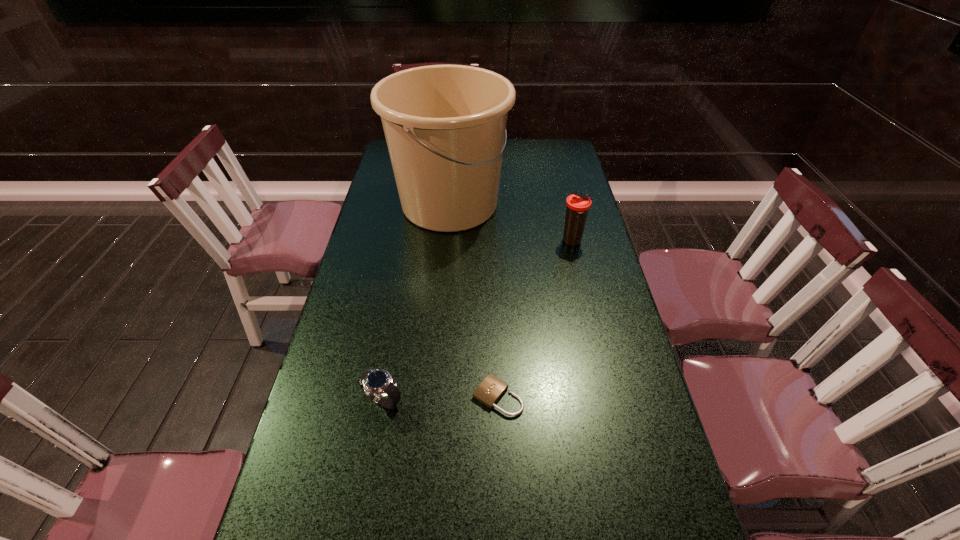
I want to click on vacant point located between the third shortest object and the tallest object, so click(511, 223).

Locate an element on the screen. empty space between the bucket and the watch is located at coordinates click(417, 302).

The height and width of the screenshot is (540, 960). Find the location of `free space between the watch and the second tallest object`. free space between the watch and the second tallest object is located at coordinates (478, 321).

Find the location of a particular element. The image size is (960, 540). empty space that is in between the bucket and the watch is located at coordinates (417, 302).

At what (x,y) coordinates should I click in order to perform the action: click on vacant point located between the bucket and the shortest object. Please return your answer as a coordinate pair (x, y). Looking at the image, I should click on (474, 300).

The image size is (960, 540). I want to click on object that is the second closest to the second tallest object, so click(x=490, y=390).

The width and height of the screenshot is (960, 540). I want to click on object that is the second closest to the tallest object, so click(x=490, y=390).

What are the coordinates of `vacant region that satisfies the following two spatial constraints: 1. on the back side of the bucket; 2. on the right side of the watch` in the screenshot? It's located at (418, 204).

You are a GUI agent. You are given a task and a screenshot of the screen. Output one action in this format:
    pyautogui.click(x=<x>, y=<y>)
    Task: Click on the free space in the image that satisfies the following two spatial constraints: 1. on the back side of the bucket; 2. on the left side of the third tallest object
    The width and height of the screenshot is (960, 540).
    Given the screenshot: What is the action you would take?
    pyautogui.click(x=418, y=204)

I want to click on free point that satisfies the following two spatial constraints: 1. on the back side of the shortest object; 2. on the left side of the watch, so click(x=383, y=396).